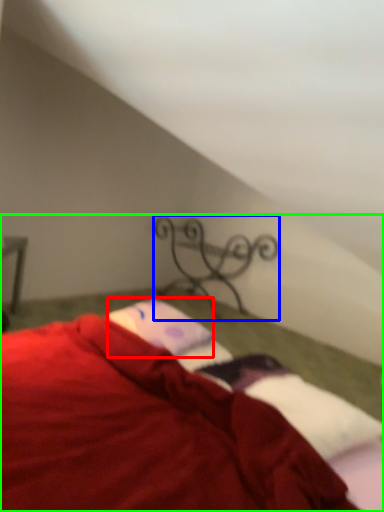
Question: Considering the real-world distances, which object is farthest from pillow (highlighted by a red box)? design (highlighted by a blue box) or bed (highlighted by a green box)?

Choices:
 (A) design
 (B) bed

Answer: (A)